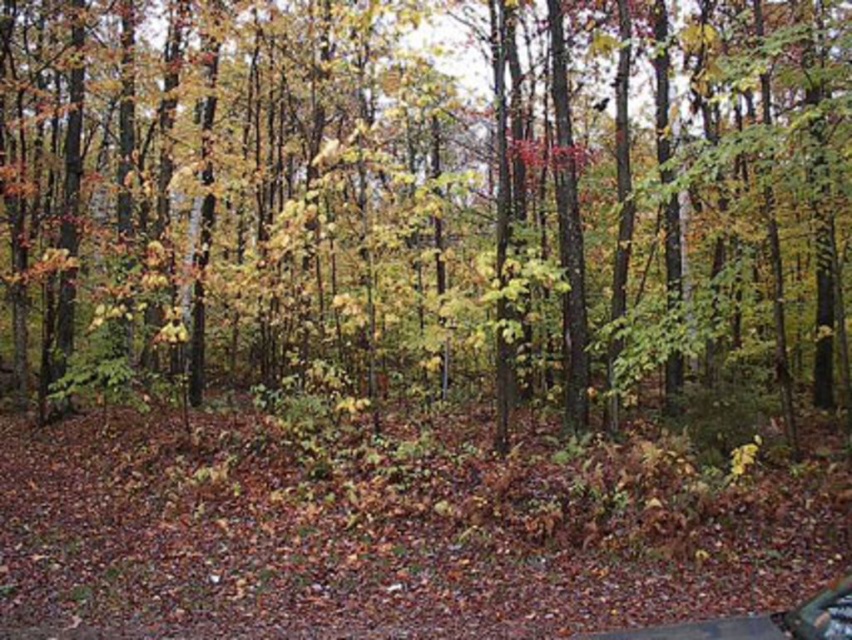
Question: Does green matte tree at center have a smaller size compared to metallic silver car at lower right?

Choices:
 (A) yes
 (B) no

Answer: (B)

Question: Is green matte tree at center positioned behind metallic silver car at lower right?

Choices:
 (A) no
 (B) yes

Answer: (B)

Question: Can you confirm if green matte tree at center is positioned below metallic silver car at lower right?

Choices:
 (A) no
 (B) yes

Answer: (A)